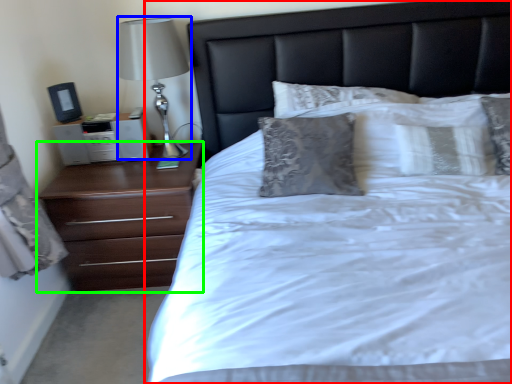
Question: Estimate the real-world distances between objects in this image. Which object is closer to bed (highlighted by a red box), table lamp (highlighted by a blue box) or chest of drawers (highlighted by a green box)?

Choices:
 (A) table lamp
 (B) chest of drawers

Answer: (B)